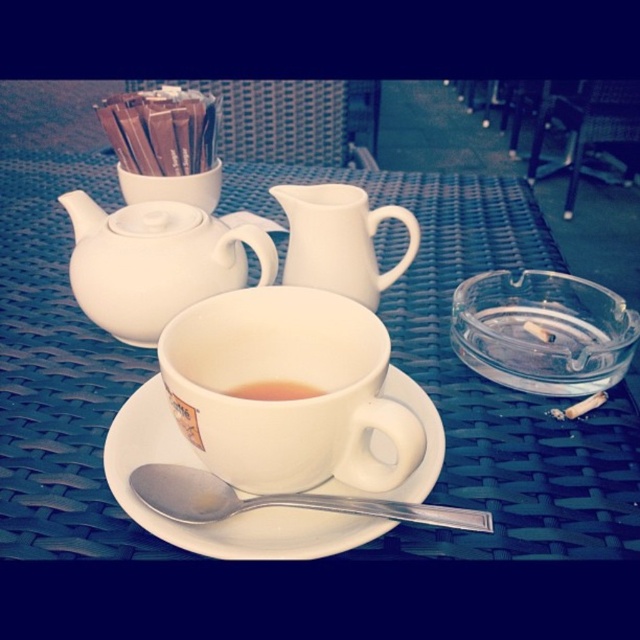
In the scene shown: You are standing at the center of the table and want to place a napkin at the point specified by the coordinates. What object is located at point (339, 241)?

The point (339, 241) corresponds to the white glossy pitcher at center.

You are a guest at a tea ceremony and see the white glossy pitcher at center and the brown matte cup at center on the table. Which object is positioned higher up?

The white glossy pitcher at center is located above the brown matte cup at center, so it is positioned higher up.